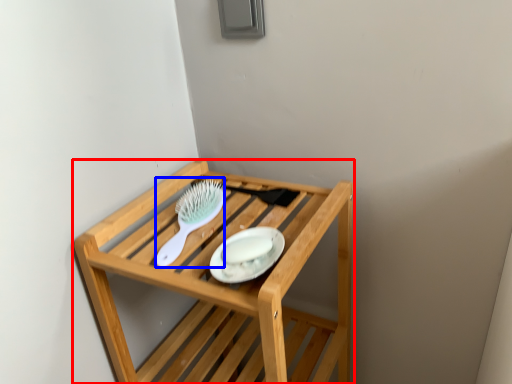
Question: Which object appears farthest to the camera in this image, furniture (highlighted by a red box) or brush (highlighted by a blue box)?

Choices:
 (A) furniture
 (B) brush

Answer: (B)